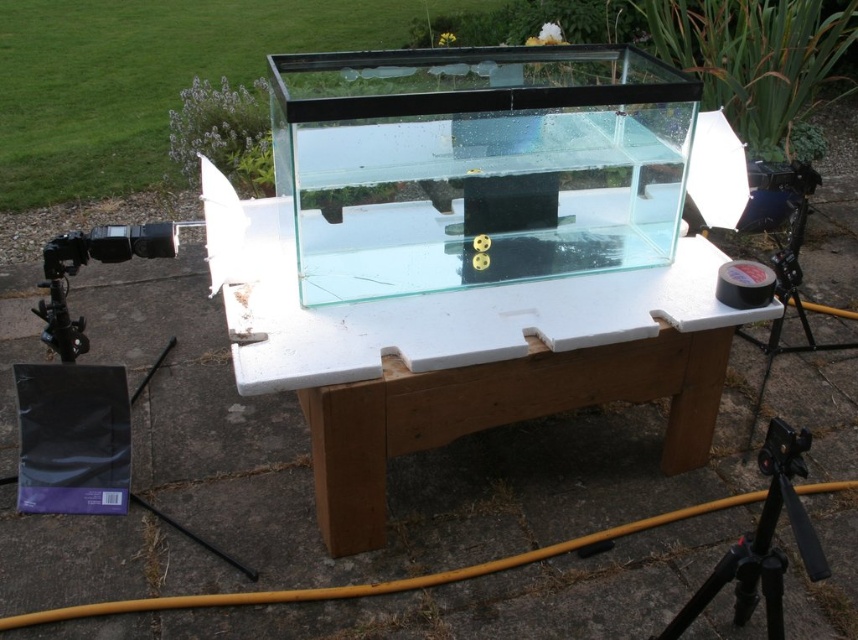
Can you confirm if black matte tripod at lower right is thinner than black rubber tape at right?

Yes, black matte tripod at lower right is thinner than black rubber tape at right.

Based on the photo, how far apart are black matte tripod at lower right and black rubber tape at right?

33.14 inches

Find the location of a particular element. black matte tripod at lower right is located at coordinates (763, 541).

Identify the location of black matte tripod at lower right. (763, 541).

Between transparent plastic table at center and black rubber tape at right, which one is positioned higher?

black rubber tape at right

Between transparent plastic table at center and black rubber tape at right, which one is positioned lower?

Positioned lower is transparent plastic table at center.

Which is behind, point (492, 332) or point (766, 346)?

Point (766, 346)

You are a GUI agent. You are given a task and a screenshot of the screen. Output one action in this format:
    pyautogui.click(x=<x>, y=<y>)
    Task: Click on the transparent plastic table at center
    
    Given the screenshot: What is the action you would take?
    482,369

Measure the distance between transparent plastic table at center and black matte tripod at lower right.

transparent plastic table at center and black matte tripod at lower right are 27.11 inches apart from each other.

Can you confirm if transparent plastic table at center is shorter than black matte tripod at lower right?

No.

Does point (231, 346) lie in front of point (825, 568)?

No, (231, 346) is further to viewer.

What are the coordinates of `transparent plastic table at center` in the screenshot? It's located at [x=482, y=369].